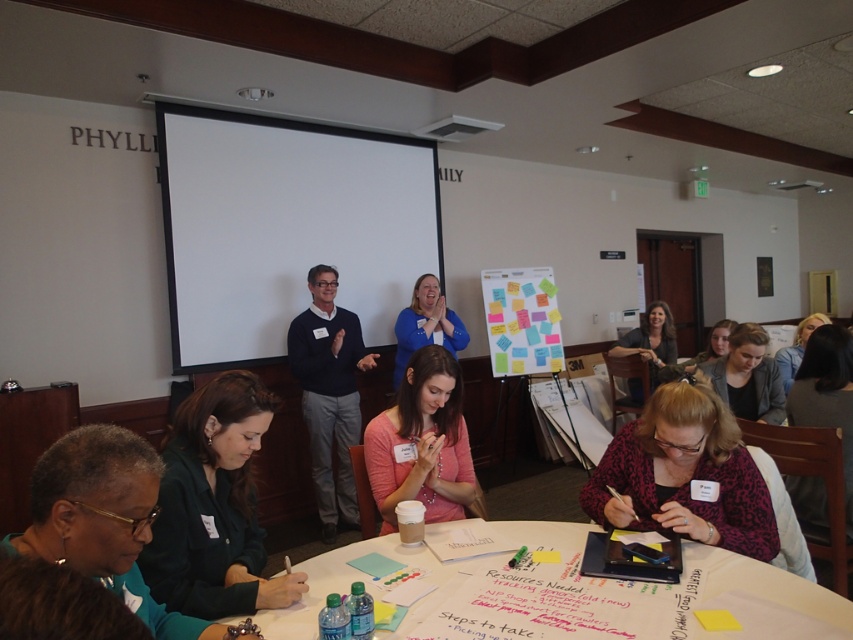
Question: Is leopard print sweater at lower right in front of pink matte shirt at center?

Choices:
 (A) yes
 (B) no

Answer: (A)

Question: Does dark blue sweater at center appear on the left side of matte gray sweater at center?

Choices:
 (A) yes
 (B) no

Answer: (A)

Question: Which point appears farthest from the camera in this image?

Choices:
 (A) (457, 346)
 (B) (292, 371)

Answer: (A)

Question: Which point is closer to the camera?

Choices:
 (A) blue fabric shirt at center
 (B) matte green shirt at lower left
 (C) matte gray sweater at center

Answer: (B)

Question: Considering the real-world distances, which object is closest to the blue fabric shirt at center?

Choices:
 (A) matte green shirt at lower left
 (B) matte gray sweater at center

Answer: (B)

Question: Does white paper at center have a greater width compared to dark blue sweater at center?

Choices:
 (A) no
 (B) yes

Answer: (B)